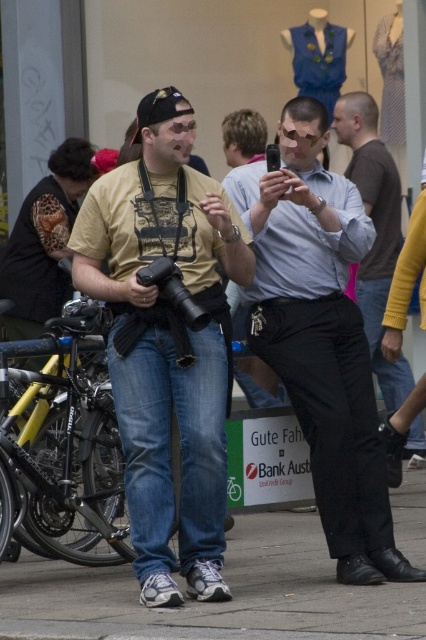
In the scene shown: You are a photographer trying to capture a candid shot of the two men in the scene. The matte blue shirt at center and the black leather pants at right are your subjects. Considering their heights, which subject should you focus on to ensure they are both in frame without cropping?

The matte blue shirt at center is taller than the black leather pants at right, so focusing on the matte blue shirt at center will ensure both subjects are in frame without cropping.